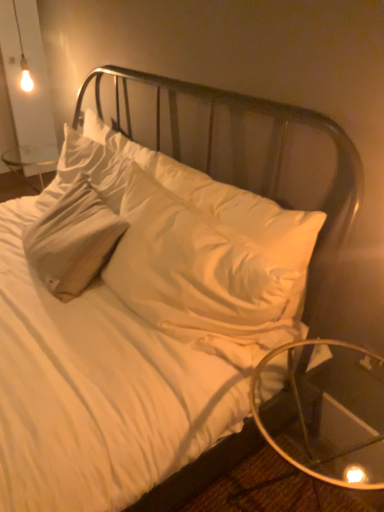
Question: Which is correct: transparent glass table at lower right is inside white soft pillow at center, or outside of it?

Choices:
 (A) outside
 (B) inside

Answer: (A)

Question: Based on their sizes in the image, would you say transparent glass table at lower right is bigger or smaller than white soft pillow at center?

Choices:
 (A) small
 (B) big

Answer: (A)

Question: In the image, is transparent glass table at lower right on the left side or the right side of white soft pillow at center?

Choices:
 (A) left
 (B) right

Answer: (B)

Question: In terms of width, does white soft pillow at center look wider or thinner when compared to transparent glass table at lower right?

Choices:
 (A) thin
 (B) wide

Answer: (A)

Question: From the image's perspective, is white soft pillow at center located above or below transparent glass table at lower right?

Choices:
 (A) above
 (B) below

Answer: (A)

Question: Considering the positions of white soft pillow at center and transparent glass table at lower right in the image, is white soft pillow at center taller or shorter than transparent glass table at lower right?

Choices:
 (A) short
 (B) tall

Answer: (B)

Question: Would you say white soft pillow at center is to the left or to the right of transparent glass table at lower right in the picture?

Choices:
 (A) left
 (B) right

Answer: (A)